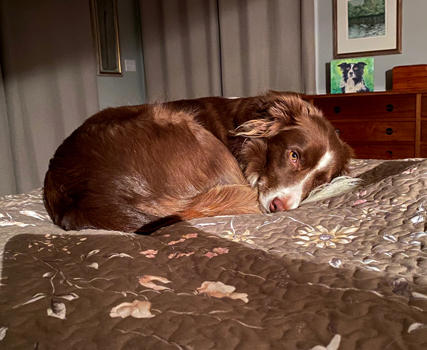
Where is `picture`? Image resolution: width=427 pixels, height=350 pixels. picture is located at coordinates (367, 43).